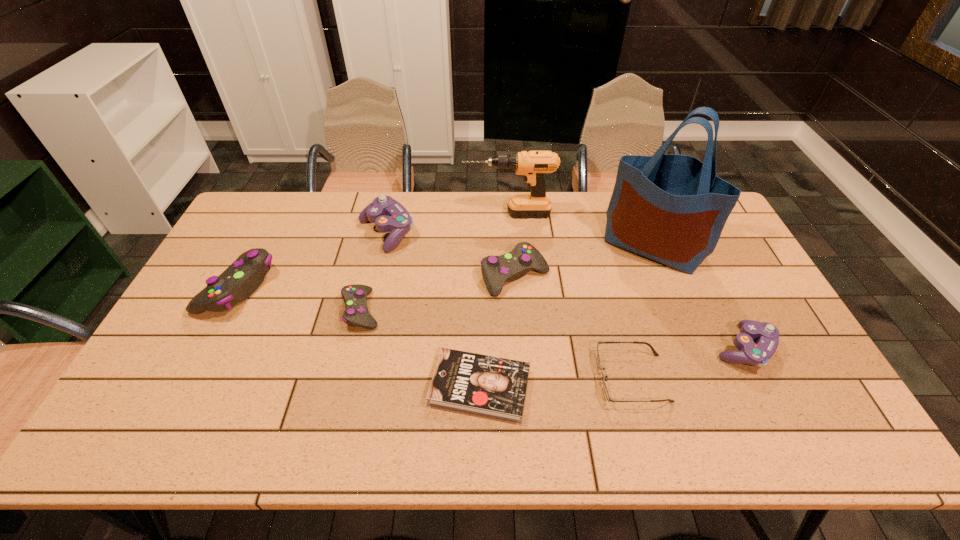
At what (x,y) coordinates should I click in order to perform the action: click on vacant space that satisfies the following two spatial constraints: 1. on the back side of the biggest gray control; 2. on the left side of the tallest object. Please return your answer as a coordinate pair (x, y). This screenshot has width=960, height=540. Looking at the image, I should click on (259, 246).